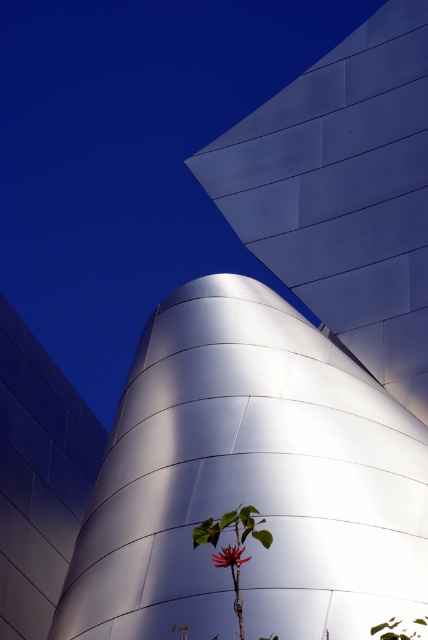
Who is more forward, (235, 556) or (226, 566)?

Positioned in front is point (235, 556).

Is green leafy plant at lower center to the right of bright red flower at center from the viewer's perspective?

Incorrect, green leafy plant at lower center is not on the right side of bright red flower at center.

Where is `green leafy plant at lower center`? green leafy plant at lower center is located at coordinates point(232,547).